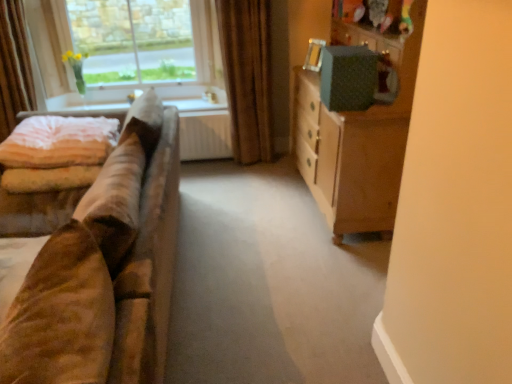
What do you see at coordinates (356, 136) in the screenshot?
I see `green textured cabinet at right` at bounding box center [356, 136].

Locate an element on the screen. The height and width of the screenshot is (384, 512). suede brown couch at left is located at coordinates [x=105, y=270].

Describe the element at coordinates (105, 270) in the screenshot. I see `suede brown couch at left` at that location.

Describe the element at coordinates (129, 47) in the screenshot. The height and width of the screenshot is (384, 512). I see `clear glass window at upper left` at that location.

Locate an element on the screen. Image resolution: width=512 pixels, height=384 pixels. green textured cabinet at right is located at coordinates (356, 136).

From the image's perspective, is brown velvet curtain at upper center, which ranks as the 1th curtain in right-to-left order, positioned above or below clear glass window at upper left?

From the image's perspective, brown velvet curtain at upper center, which ranks as the 1th curtain in right-to-left order, appears below clear glass window at upper left.

Is brown velvet curtain at upper center, which is the second curtain from left to right, aimed at clear glass window at upper left?

No, brown velvet curtain at upper center, which is the second curtain from left to right, is not oriented towards clear glass window at upper left.

From a real-world perspective, is brown velvet curtain at upper center, which ranks as the 1th curtain in right-to-left order, on clear glass window at upper left?

No, from a real-world perspective, brown velvet curtain at upper center, which ranks as the 1th curtain in right-to-left order, is not over clear glass window at upper left

Relative to white fabric at upper left, is clear glass window at upper left in front or behind?

clear glass window at upper left is positioned closer to the viewer than white fabric at upper left.

Is clear glass window at upper left far away from white fabric at upper left?

That's not correct — clear glass window at upper left is a little close to white fabric at upper left.

From a real-world perspective, who is located lower, clear glass window at upper left or white fabric at upper left?

In real-world perspective, white fabric at upper left is lower.

Is clear glass window at upper left facing away from white fabric at upper left?

No, clear glass window at upper left's orientation is not away from white fabric at upper left.

Which is more to the right, light pink velvety quilt at left or suede brown couch at left?

From the viewer's perspective, suede brown couch at left appears more on the right side.

Which object is further away from the camera, light pink velvety quilt at left or suede brown couch at left?

light pink velvety quilt at left is further from the camera.

Image resolution: width=512 pixels, height=384 pixels. In order to click on studio couch lying on the right of light pink velvety quilt at left in this screenshot , I will do `click(105, 270)`.

From a real-world perspective, is white fabric at upper left below light pink velvety quilt at left?

Correct, in the physical world, white fabric at upper left is lower than light pink velvety quilt at left.

From their relative heights in the image, would you say white fabric at upper left is taller or shorter than light pink velvety quilt at left?

Clearly, white fabric at upper left is shorter compared to light pink velvety quilt at left.

Considering the relative positions of white fabric at upper left and light pink velvety quilt at left in the image provided, is white fabric at upper left behind light pink velvety quilt at left?

Yes, white fabric at upper left is behind light pink velvety quilt at left.

You are a GUI agent. You are given a task and a screenshot of the screen. Output one action in this format:
    pyautogui.click(x=<x>, y=<y>)
    Task: Click on the window sill below the light pink velvety quilt at left (from a real-world perspective)
    
    Given the screenshot: What is the action you would take?
    pyautogui.click(x=88, y=101)

Is light pink velvety quilt at left oriented towards white fabric at upper left?

No, light pink velvety quilt at left is not aimed at white fabric at upper left.

What's the angular difference between light pink velvety quilt at left and white fabric at upper left's facing directions?

There is a 3.12-degree angle between the facing directions of light pink velvety quilt at left and white fabric at upper left.

From the image's perspective, between light pink velvety quilt at left and white fabric at upper left, who is located below?

light pink velvety quilt at left is shown below in the image.

The height and width of the screenshot is (384, 512). Find the location of `window sill beneath the light pink velvety quilt at left (from a real-world perspective)`. window sill beneath the light pink velvety quilt at left (from a real-world perspective) is located at coordinates (88, 101).

Which of these two, brown velvet curtain at upper center, which ranks as the 1th curtain in right-to-left order, or light pink velvety quilt at left, stands shorter?

Standing shorter between the two is light pink velvety quilt at left.

Between brown velvet curtain at upper center, which is the second curtain from left to right, and light pink velvety quilt at left, which one has larger width?

light pink velvety quilt at left.

Image resolution: width=512 pixels, height=384 pixels. In order to click on quilt lying on the left of brown velvet curtain at upper center, which is the second curtain from left to right in this screenshot , I will do `click(59, 142)`.

In the image, is brown velvet curtain at upper center, which ranks as the 1th curtain in right-to-left order, positioned in front of or behind light pink velvety quilt at left?

brown velvet curtain at upper center, which ranks as the 1th curtain in right-to-left order, is positioned farther from the viewer than light pink velvety quilt at left.

Is clear glass window at upper left positioned far away from green textured cabinet at right?

Yes, clear glass window at upper left and green textured cabinet at right are quite far apart.

Is clear glass window at upper left taller than green textured cabinet at right?

No.

Would you say clear glass window at upper left is outside green textured cabinet at right?

clear glass window at upper left is positioned outside green textured cabinet at right.

Between point (64, 68) and point (359, 208), which one is positioned behind?

The point (64, 68) is farther.

From the image's perspective, starting from the clear glass window at upper left, which curtain is the 1st one below? Please provide its 2D coordinates.

[(247, 76)]

At what (x,y) coordinates should I click in order to perform the action: click on window sill below the clear glass window at upper left (from a real-world perspective). Please return your answer as a coordinate pair (x, y). The image size is (512, 384). Looking at the image, I should click on (88, 101).

Estimate the real-world distances between objects in this image. Which object is closer to clear glass window at upper left, green textured cabinet at right or brown velvet curtain at upper center, which is the second curtain from left to right?

Based on the image, brown velvet curtain at upper center, which is the second curtain from left to right, appears to be nearer to clear glass window at upper left.

When comparing their distances from brown velvet curtain at upper center, which ranks as the 1th curtain in right-to-left order, does light pink velvety quilt at left or white fabric at upper left seem closer?

white fabric at upper left is closer to brown velvet curtain at upper center, which ranks as the 1th curtain in right-to-left order.

Based on their spatial positions, is light pink velvety quilt at left or brown velvet curtain at upper center, which is the second curtain from left to right, closer to suede brown couch at left?

Based on the image, light pink velvety quilt at left appears to be nearer to suede brown couch at left.

Estimate the real-world distances between objects in this image. Which object is further from clear glass window at upper left, green textured cabinet at right or velvet curtain at left, the second curtain from the right?

green textured cabinet at right lies further to clear glass window at upper left than the other object.

From the image, which object appears to be nearer to light pink velvety quilt at left, velvet curtain at left, the second curtain from the right, or green textured cabinet at right?

velvet curtain at left, the second curtain from the right, is positioned closer to the anchor light pink velvety quilt at left.

Consider the image. Looking at the image, which one is located further to suede brown couch at left, velvet curtain at left, positioned as the first curtain in left-to-right order, or white fabric at upper left?

white fabric at upper left lies further to suede brown couch at left than the other object.

Looking at the image, which one is located further to green textured cabinet at right, white fabric at upper left or light pink velvety quilt at left?

light pink velvety quilt at left lies further to green textured cabinet at right than the other object.

Based on their spatial positions, is green textured cabinet at right or brown velvet curtain at upper center, which is the second curtain from left to right, closer to light pink velvety quilt at left?

brown velvet curtain at upper center, which is the second curtain from left to right, lies closer to light pink velvety quilt at left than the other object.

Where is `quilt situated between velvet curtain at left, the second curtain from the right, and green textured cabinet at right from left to right`? This screenshot has height=384, width=512. quilt situated between velvet curtain at left, the second curtain from the right, and green textured cabinet at right from left to right is located at coordinates (59, 142).

What are the coordinates of `window between light pink velvety quilt at left and green textured cabinet at right in the horizontal direction` in the screenshot? It's located at (129, 47).

Image resolution: width=512 pixels, height=384 pixels. I want to click on studio couch situated between light pink velvety quilt at left and green textured cabinet at right from left to right, so click(105, 270).

Where is `window located between light pink velvety quilt at left and brown velvet curtain at upper center, which is the second curtain from left to right, in the left-right direction`? window located between light pink velvety quilt at left and brown velvet curtain at upper center, which is the second curtain from left to right, in the left-right direction is located at coordinates (129, 47).